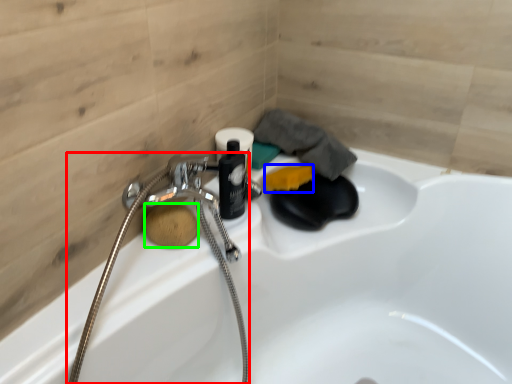
Question: Estimate the real-world distances between objects in this image. Which object is farther from garden hose (highlighted by a red box), soap (highlighted by a blue box) or soap (highlighted by a green box)?

Choices:
 (A) soap
 (B) soap

Answer: (A)